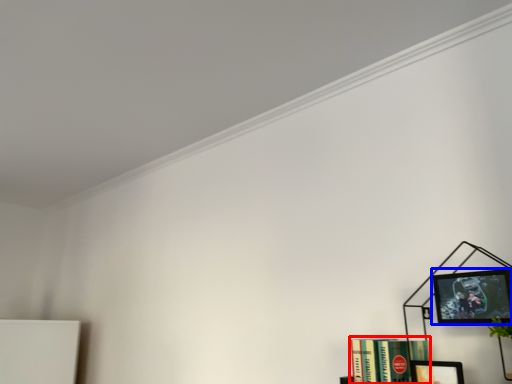
Question: Which of the following is the farthest to the observer, book (highlighted by a red box) or picture frame (highlighted by a blue box)?

Choices:
 (A) book
 (B) picture frame

Answer: (A)